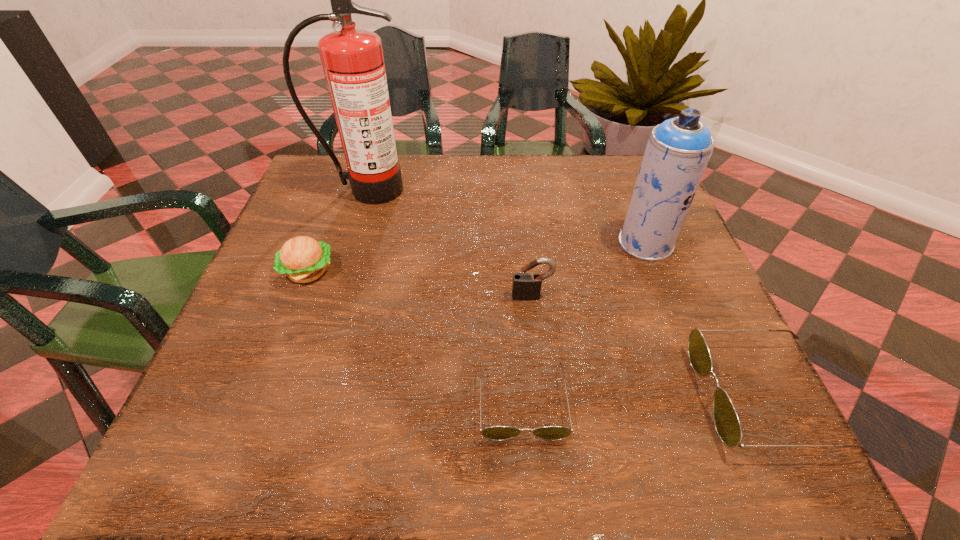
Where is `free space located on the front-facing side of the taller sunglasses`? This screenshot has width=960, height=540. free space located on the front-facing side of the taller sunglasses is located at coordinates (x=559, y=396).

Locate an element on the screen. The image size is (960, 540). free space located on the front-facing side of the taller sunglasses is located at coordinates (588, 396).

Locate an element on the screen. free space located 0.360m on the front-facing side of the taller sunglasses is located at coordinates (487, 396).

You are a GUI agent. You are given a task and a screenshot of the screen. Output one action in this format:
    pyautogui.click(x=<x>, y=<y>)
    Task: Click on the free space located on the front-facing side of the fire extinguisher
    The height and width of the screenshot is (540, 960).
    Given the screenshot: What is the action you would take?
    pyautogui.click(x=338, y=287)

Identify the location of free location located with the keyhole on the front of the padlock. This screenshot has height=540, width=960. (537, 341).

Image resolution: width=960 pixels, height=540 pixels. Identify the location of vacant area situated on the back of the hamburger. 323,234.

The height and width of the screenshot is (540, 960). In order to click on vacant area situated 0.400m on the left of the fifth shortest object in this screenshot , I will do `click(443, 243)`.

The image size is (960, 540). Find the location of `object at the far edge`. object at the far edge is located at coordinates (352, 59).

The image size is (960, 540). I want to click on fire extinguisher present at the left edge, so click(x=352, y=59).

Where is `hamburger at the left edge`? hamburger at the left edge is located at coordinates (303, 259).